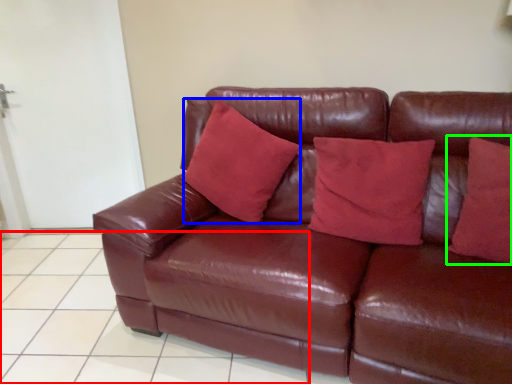
Question: Which object is the closest to the tile (highlighted by a red box)? Choose among these: pillow (highlighted by a blue box) or pillow (highlighted by a green box).

Choices:
 (A) pillow
 (B) pillow

Answer: (A)